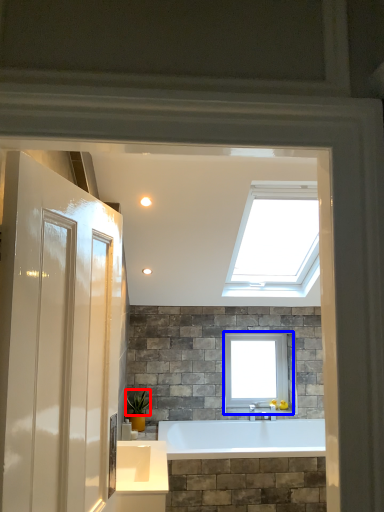
Question: Which point is closer to the camera, plant (highlighted by a red box) or window (highlighted by a blue box)?

Choices:
 (A) plant
 (B) window

Answer: (A)